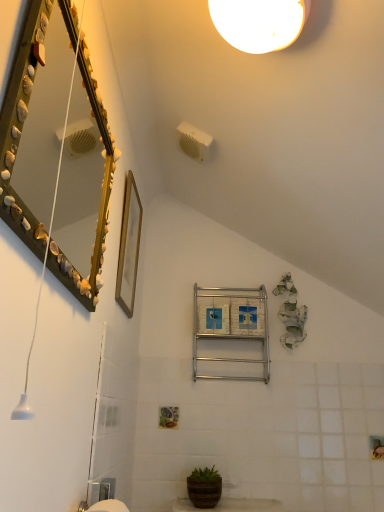
Question: Does wooden picture frame at upper center contain seashell-covered mirror at upper left?

Choices:
 (A) yes
 (B) no

Answer: (B)

Question: Can you confirm if wooden picture frame at upper center is smaller than seashell-covered mirror at upper left?

Choices:
 (A) yes
 (B) no

Answer: (A)

Question: From a real-world perspective, is wooden picture frame at upper center physically above seashell-covered mirror at upper left?

Choices:
 (A) no
 (B) yes

Answer: (B)

Question: Can you confirm if wooden picture frame at upper center is wider than seashell-covered mirror at upper left?

Choices:
 (A) no
 (B) yes

Answer: (A)

Question: Is wooden picture frame at upper center to the right of seashell-covered mirror at upper left from the viewer's perspective?

Choices:
 (A) no
 (B) yes

Answer: (B)

Question: From a real-world perspective, relative to seashell-covered mirror at upper left, is wooden picture frame at upper center vertically above or below?

Choices:
 (A) above
 (B) below

Answer: (A)

Question: Is wooden picture frame at upper center inside the boundaries of seashell-covered mirror at upper left, or outside?

Choices:
 (A) inside
 (B) outside

Answer: (B)

Question: Looking at their shapes, would you say wooden picture frame at upper center is wider or thinner than seashell-covered mirror at upper left?

Choices:
 (A) wide
 (B) thin

Answer: (B)

Question: From their relative heights in the image, would you say wooden picture frame at upper center is taller or shorter than seashell-covered mirror at upper left?

Choices:
 (A) short
 (B) tall

Answer: (A)

Question: Relative to brown textured pot at lower center, is seashell-covered mirror at upper left in front or behind?

Choices:
 (A) behind
 (B) front

Answer: (B)

Question: Is seashell-covered mirror at upper left inside or outside of brown textured pot at lower center?

Choices:
 (A) outside
 (B) inside

Answer: (A)

Question: Is point (62, 56) closer or farther from the camera than point (218, 496)?

Choices:
 (A) farther
 (B) closer

Answer: (B)

Question: Looking at their shapes, would you say seashell-covered mirror at upper left is wider or thinner than brown textured pot at lower center?

Choices:
 (A) thin
 (B) wide

Answer: (A)

Question: From their relative heights in the image, would you say brown textured pot at lower center is taller or shorter than silver metallic towel rack at center?

Choices:
 (A) short
 (B) tall

Answer: (A)

Question: Is brown textured pot at lower center bigger or smaller than silver metallic towel rack at center?

Choices:
 (A) big
 (B) small

Answer: (B)